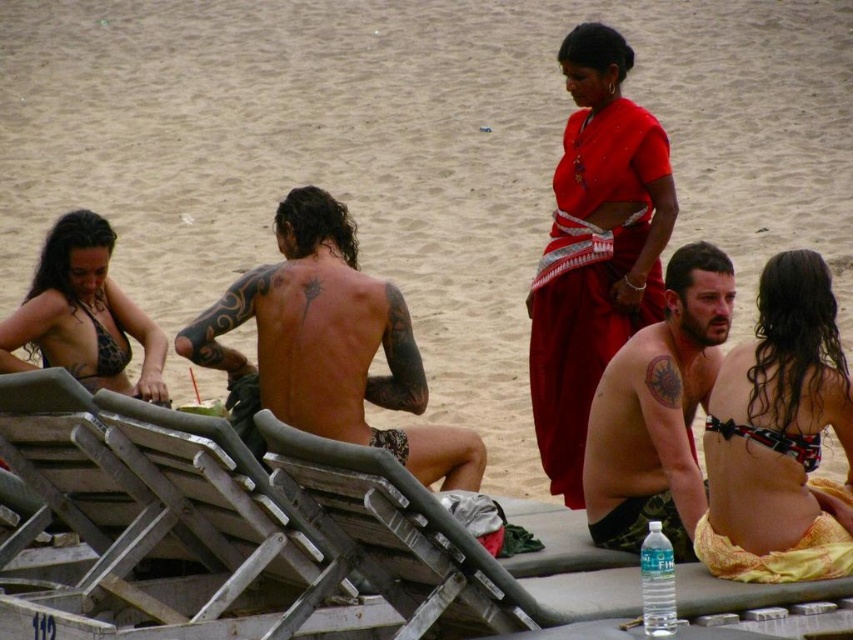
Does point (830, 596) come farther from viewer compared to point (670, 301)?

No, (830, 596) is closer to viewer.

Does wooden beach chair at center appear on the left side of shiny metallic tattoo at center?

Yes, wooden beach chair at center is to the left of shiny metallic tattoo at center.

Image resolution: width=853 pixels, height=640 pixels. Find the location of `wooden beach chair at center`. wooden beach chair at center is located at coordinates (444, 545).

Can you confirm if printed bikini top at center is wider than leopard print bikini top at lower left?

In fact, printed bikini top at center might be narrower than leopard print bikini top at lower left.

Can you confirm if printed bikini top at center is taller than leopard print bikini top at lower left?

No, printed bikini top at center is not taller than leopard print bikini top at lower left.

Between point (851, 449) and point (94, 371), which one is positioned behind?

Point (94, 371)

Locate an element on the screen. This screenshot has height=640, width=853. printed bikini top at center is located at coordinates click(x=779, y=436).

Is wooden beach chair at center to the right of red silk sari at center from the viewer's perspective?

Incorrect, wooden beach chair at center is not on the right side of red silk sari at center.

Which is in front, point (415, 506) or point (613, 280)?

Point (415, 506) is in front.

This screenshot has width=853, height=640. Find the location of `wooden beach chair at center`. wooden beach chair at center is located at coordinates (444, 545).